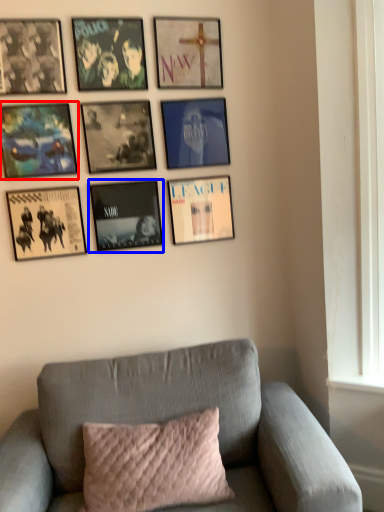
Question: Among these objects, which one is farthest to the camera, picture frame (highlighted by a red box) or picture frame (highlighted by a blue box)?

Choices:
 (A) picture frame
 (B) picture frame

Answer: (B)